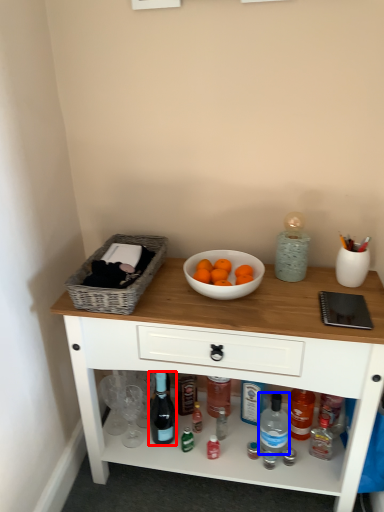
Question: Which of the following is the closest to the observer, bottle (highlighted by a red box) or bottle (highlighted by a blue box)?

Choices:
 (A) bottle
 (B) bottle

Answer: (A)